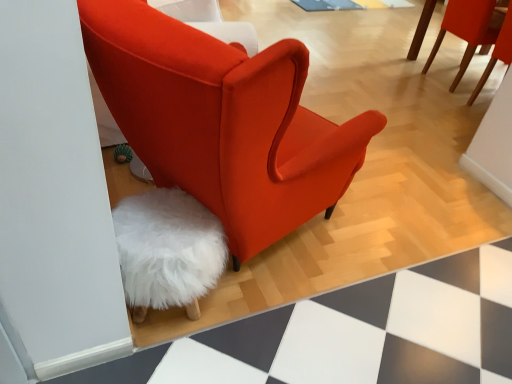
This screenshot has width=512, height=384. What do you see at coordinates (466, 30) in the screenshot? I see `matte red chair at upper right, which is counted as the second chair, starting from the bottom` at bounding box center [466, 30].

What is the approximate height of matte red chair at upper right, the 1th chair in the back-to-front sequence?

matte red chair at upper right, the 1th chair in the back-to-front sequence, is 27.39 inches tall.

What is the approximate height of white fluffy stool at lower left?

A: The height of white fluffy stool at lower left is 15.57 inches.

The image size is (512, 384). Identify the location of white fluffy stool at lower left. (167, 250).

The width and height of the screenshot is (512, 384). In order to click on velvet orange chair at center, which ranks as the second chair in top-to-bottom order in this screenshot , I will do `click(223, 121)`.

Image resolution: width=512 pixels, height=384 pixels. What do you see at coordinates (223, 121) in the screenshot?
I see `velvet orange chair at center, arranged as the 1th chair when viewed from the front` at bounding box center [223, 121].

Identify the location of matte red chair at upper right, arranged as the first chair when viewed from the right. Image resolution: width=512 pixels, height=384 pixels. (466, 30).

Does matte red chair at upper right, arranged as the first chair when viewed from the right, have a greater width compared to velvet orange chair at center, which is the 2th chair from back to front?

No, matte red chair at upper right, arranged as the first chair when viewed from the right, is not wider than velvet orange chair at center, which is the 2th chair from back to front.

Are matte red chair at upper right, arranged as the first chair when viewed from the right, and velvet orange chair at center, which is the 2th chair from back to front, making contact?

No, matte red chair at upper right, arranged as the first chair when viewed from the right, is not making contact with velvet orange chair at center, which is the 2th chair from back to front.

From a real-world perspective, is matte red chair at upper right, the 1th chair in the back-to-front sequence, under velvet orange chair at center, placed as the first chair when sorted from bottom to top?

Indeed, from a real-world perspective, matte red chair at upper right, the 1th chair in the back-to-front sequence, is positioned beneath velvet orange chair at center, placed as the first chair when sorted from bottom to top.

Between point (465, 36) and point (251, 117), which one is positioned in front?

The point (251, 117) is closer.

Is white fluffy stool at lower left outside of matte red chair at upper right, arranged as the first chair when viewed from the right?

Yes, white fluffy stool at lower left is not within matte red chair at upper right, arranged as the first chair when viewed from the right.

Would you say white fluffy stool at lower left is a long distance from matte red chair at upper right, which is counted as the second chair, starting from the bottom?

Yes, white fluffy stool at lower left and matte red chair at upper right, which is counted as the second chair, starting from the bottom, are located far from each other.

Is white fluffy stool at lower left at the left side of matte red chair at upper right, arranged as the second chair when viewed from the left?

Correct, you'll find white fluffy stool at lower left to the left of matte red chair at upper right, arranged as the second chair when viewed from the left.

Is white fluffy stool at lower left thinner than matte red chair at upper right, arranged as the second chair when viewed from the left?

Correct, the width of white fluffy stool at lower left is less than that of matte red chair at upper right, arranged as the second chair when viewed from the left.

Considering the positions of point (200, 279) and point (85, 36), is point (200, 279) closer or farther from the camera than point (85, 36)?

Clearly, point (200, 279) is more distant from the camera than point (85, 36).

Which is behind, white fluffy stool at lower left or velvet orange chair at center, marked as the 2th chair in a right-to-left arrangement?

white fluffy stool at lower left is further away from the camera.

Is there a large distance between white fluffy stool at lower left and velvet orange chair at center, which ranks as the second chair in top-to-bottom order?

No, there isn't a large distance between white fluffy stool at lower left and velvet orange chair at center, which ranks as the second chair in top-to-bottom order.

From the image's perspective, between velvet orange chair at center, placed as the first chair when sorted from bottom to top, and matte red chair at upper right, which is counted as the second chair, starting from the bottom, which one is located above?

matte red chair at upper right, which is counted as the second chair, starting from the bottom, is shown above in the image.

Does velvet orange chair at center, which ranks as the second chair in top-to-bottom order, have a smaller size compared to matte red chair at upper right, the first chair in the top-to-bottom sequence?

Incorrect, velvet orange chair at center, which ranks as the second chair in top-to-bottom order, is not smaller in size than matte red chair at upper right, the first chair in the top-to-bottom sequence.

Who is taller, velvet orange chair at center, marked as the 2th chair in a right-to-left arrangement, or matte red chair at upper right, the first chair in the top-to-bottom sequence?

Standing taller between the two is velvet orange chair at center, marked as the 2th chair in a right-to-left arrangement.

Based on the photo, considering the positions of objects velvet orange chair at center, placed as the first chair when sorted from bottom to top, and matte red chair at upper right, positioned as the second chair in front-to-back order, in the image provided, who is behind, velvet orange chair at center, placed as the first chair when sorted from bottom to top, or matte red chair at upper right, positioned as the second chair in front-to-back order,?

matte red chair at upper right, positioned as the second chair in front-to-back order, is behind.

Based on the photo, is matte red chair at upper right, the first chair in the top-to-bottom sequence, looking in the opposite direction of white fluffy stool at lower left?

No, matte red chair at upper right, the first chair in the top-to-bottom sequence, is not facing the opposite direction of white fluffy stool at lower left.

From a real-world perspective, which object stands above the other?

matte red chair at upper right, the 1th chair in the back-to-front sequence, is physically above.

Would you say matte red chair at upper right, which is counted as the second chair, starting from the bottom, is outside white fluffy stool at lower left?

Yes, matte red chair at upper right, which is counted as the second chair, starting from the bottom, is outside of white fluffy stool at lower left.

Considering the sizes of objects matte red chair at upper right, the first chair in the top-to-bottom sequence, and white fluffy stool at lower left in the image provided, who is smaller, matte red chair at upper right, the first chair in the top-to-bottom sequence, or white fluffy stool at lower left?

white fluffy stool at lower left is smaller.

Is velvet orange chair at center, arranged as the 1th chair when viewed from the front, far away from white fluffy stool at lower left?

No, velvet orange chair at center, arranged as the 1th chair when viewed from the front, is not far from white fluffy stool at lower left.

Choose the correct answer: Is velvet orange chair at center, placed as the first chair when sorted from bottom to top, inside white fluffy stool at lower left or outside it?

velvet orange chair at center, placed as the first chair when sorted from bottom to top, is not inside white fluffy stool at lower left, it's outside.

From a real-world perspective, which object rests below the other?

white fluffy stool at lower left is physically lower.

Considering the relative positions of velvet orange chair at center, which ranks as the second chair in top-to-bottom order, and white fluffy stool at lower left in the image provided, is velvet orange chair at center, which ranks as the second chair in top-to-bottom order, to the right of white fluffy stool at lower left from the viewer's perspective?

Yes, velvet orange chair at center, which ranks as the second chair in top-to-bottom order, is to the right of white fluffy stool at lower left.

Locate an element on the screen. chair that is above the velvet orange chair at center, which is the 2th chair from back to front (from the image's perspective) is located at coordinates (466, 30).

From a real-world perspective, which chair is the 1st one above the white fluffy stool at lower left? Please provide its 2D coordinates.

[(466, 30)]

Estimate the real-world distances between objects in this image. Which object is further from matte red chair at upper right, positioned as the second chair in front-to-back order, velvet orange chair at center, which ranks as the second chair in top-to-bottom order, or white fluffy stool at lower left?

Among the two, white fluffy stool at lower left is located further to matte red chair at upper right, positioned as the second chair in front-to-back order.

From the image, which object appears to be farther from white fluffy stool at lower left, matte red chair at upper right, the 1th chair in the back-to-front sequence, or velvet orange chair at center, which is the 2th chair from back to front?

matte red chair at upper right, the 1th chair in the back-to-front sequence, is positioned further to the anchor white fluffy stool at lower left.

From the picture: Looking at the image, which one is located further to matte red chair at upper right, the 1th chair in the back-to-front sequence, white fluffy stool at lower left or velvet orange chair at center, placed as the first chair when sorted from bottom to top?

white fluffy stool at lower left.

Estimate the real-world distances between objects in this image. Which object is further from velvet orange chair at center, arranged as the 1th chair when viewed from the front, matte red chair at upper right, positioned as the second chair in front-to-back order, or white fluffy stool at lower left?

Among the two, matte red chair at upper right, positioned as the second chair in front-to-back order, is located further to velvet orange chair at center, arranged as the 1th chair when viewed from the front.

Considering their positions, is velvet orange chair at center, which ranks as the second chair in top-to-bottom order, positioned closer to white fluffy stool at lower left than matte red chair at upper right, arranged as the first chair when viewed from the right?

velvet orange chair at center, which ranks as the second chair in top-to-bottom order.

Based on their spatial positions, is white fluffy stool at lower left or matte red chair at upper right, which is counted as the second chair, starting from the bottom, further from velvet orange chair at center, which appears as the first chair when viewed from the left?

The object further to velvet orange chair at center, which appears as the first chair when viewed from the left, is matte red chair at upper right, which is counted as the second chair, starting from the bottom.

Locate an element on the screen. chair situated between white fluffy stool at lower left and matte red chair at upper right, which is counted as the second chair, starting from the bottom, from left to right is located at coordinates (223, 121).